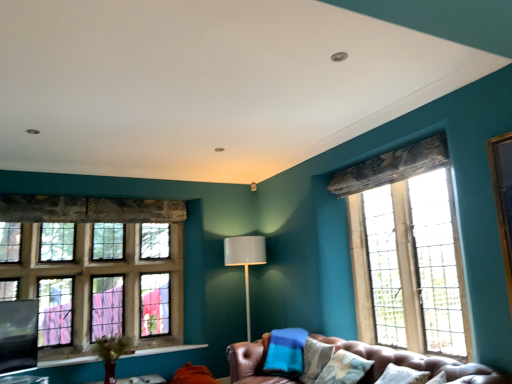
Question: Is leather couch at lower center taller or shorter than clear glass window at right, which is counted as the 2th window, starting from the back?

Choices:
 (A) short
 (B) tall

Answer: (A)

Question: Relative to clear glass window at right, the second window from the left, is leather couch at lower center in front or behind?

Choices:
 (A) behind
 (B) front

Answer: (B)

Question: Considering the real-world distances, which object is farthest from the matte gray lamp at center?

Choices:
 (A) clear glass window at right, which is counted as the 2th window, starting from the back
 (B) leather couch at lower center
 (C) black matte window screen at lower left
 (D) stained glass window at left, which is counted as the second window, starting from the right
 (E) wooden table at lower center

Answer: (C)

Question: Which of these objects is positioned farthest from the matte gray lamp at center?

Choices:
 (A) leather couch at lower center
 (B) wooden table at lower center
 (C) clear glass window at right, the second window from the left
 (D) stained glass window at left, the 1th window from the left
 (E) black matte window screen at lower left

Answer: (E)